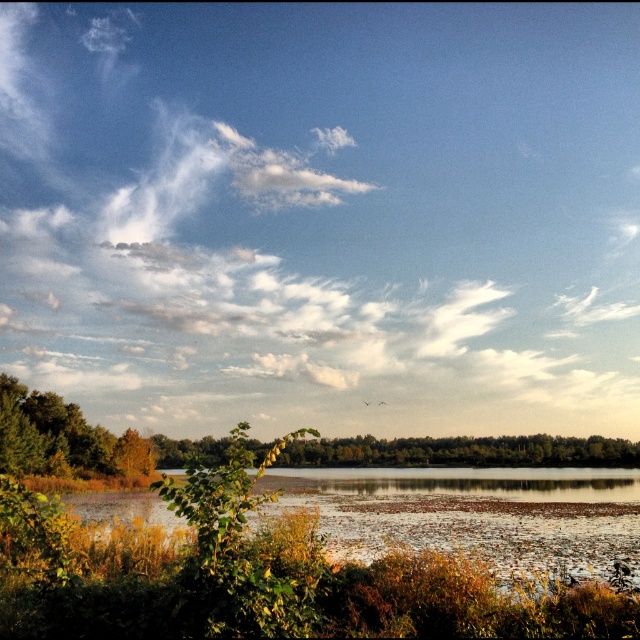
Looking at this image, is green matte tree at lower left bigger than green leafy tree at center?

Incorrect, green matte tree at lower left is not larger than green leafy tree at center.

Does green matte tree at lower left appear on the left side of green leafy tree at center?

Correct, you'll find green matte tree at lower left to the left of green leafy tree at center.

Between point (474, 452) and point (304, 464), which one is positioned in front?

Point (474, 452) is in front.

You are a GUI agent. You are given a task and a screenshot of the screen. Output one action in this format:
    pyautogui.click(x=<x>, y=<y>)
    Task: Click on the green matte tree at lower left
    
    Given the screenshot: What is the action you would take?
    pyautogui.click(x=464, y=451)

Is white fluffy cloud at upper center positioned at the back of green matte tree at lower left?

Yes, white fluffy cloud at upper center is behind green matte tree at lower left.

Between point (113, 81) and point (99, 436), which one is positioned behind?

The point (113, 81) is behind.

Between point (147, 396) and point (8, 403), which one is positioned in front?

Point (8, 403) is more forward.

Locate an element on the screen. white fluffy cloud at upper center is located at coordinates (323, 214).

Does translucent water at center have a larger size compared to green matte tree at lower left?

Incorrect, translucent water at center is not larger than green matte tree at lower left.

How far apart are translucent water at center and green matte tree at lower left?

translucent water at center is 27.15 meters away from green matte tree at lower left.

Which is behind, point (413, 499) or point (518, 440)?

The point (518, 440) is more distant.

Locate an element on the screen. translucent water at center is located at coordinates (474, 515).